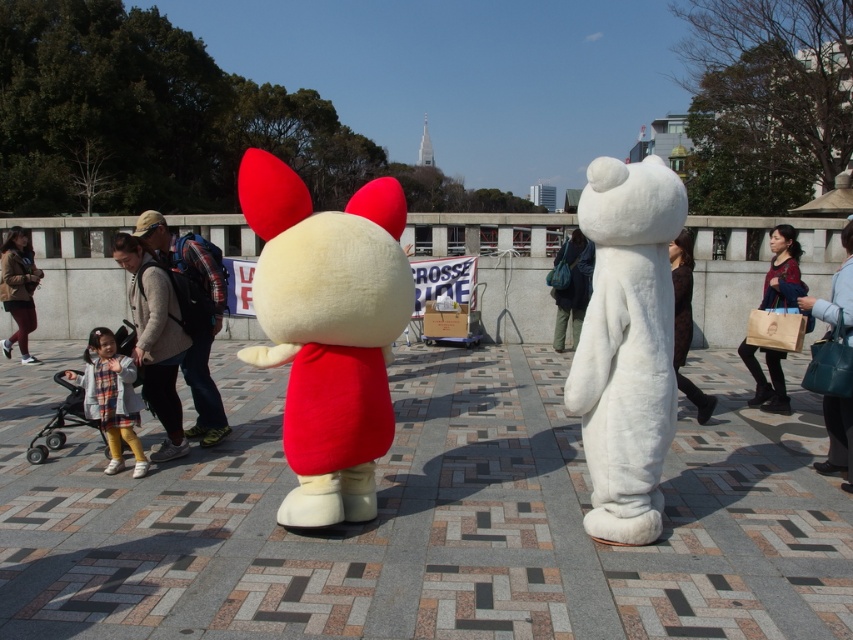
You are a photographer trying to capture both the fluffy white mascot at center and the fluffy white coat at center in a single shot. Which one should you focus on to ensure the mascot is in sharp focus while the coat appears slightly blurred?

To ensure the fluffy white mascot at center is in sharp focus while the fluffy white coat at center appears slightly blurred, focus on the fluffy white mascot at center since it is closer to the viewer. This depth of field technique will naturally blur objects further away, like the coat, creating the desired effect.

You are a photographer at the event and want to capture both the white plush bear at right and the leather handbag at right in a single frame. Which object should you focus on first to ensure both are in the shot?

The white plush bear at right is bigger than the leather handbag at right, so focusing on the white plush bear at right first will help ensure both are in the frame since it takes up more space.